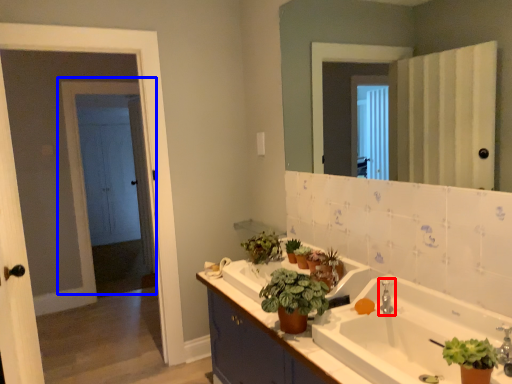
Question: Which object is further to the camera taking this photo, tap (highlighted by a red box) or door (highlighted by a blue box)?

Choices:
 (A) tap
 (B) door

Answer: (B)